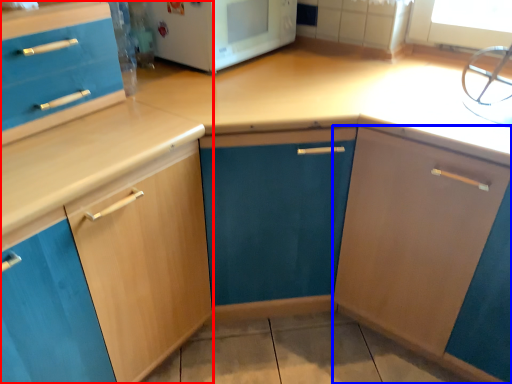
Question: Among these objects, which one is farthest to the camera, cabinetry (highlighted by a red box) or cabinetry (highlighted by a blue box)?

Choices:
 (A) cabinetry
 (B) cabinetry

Answer: (B)